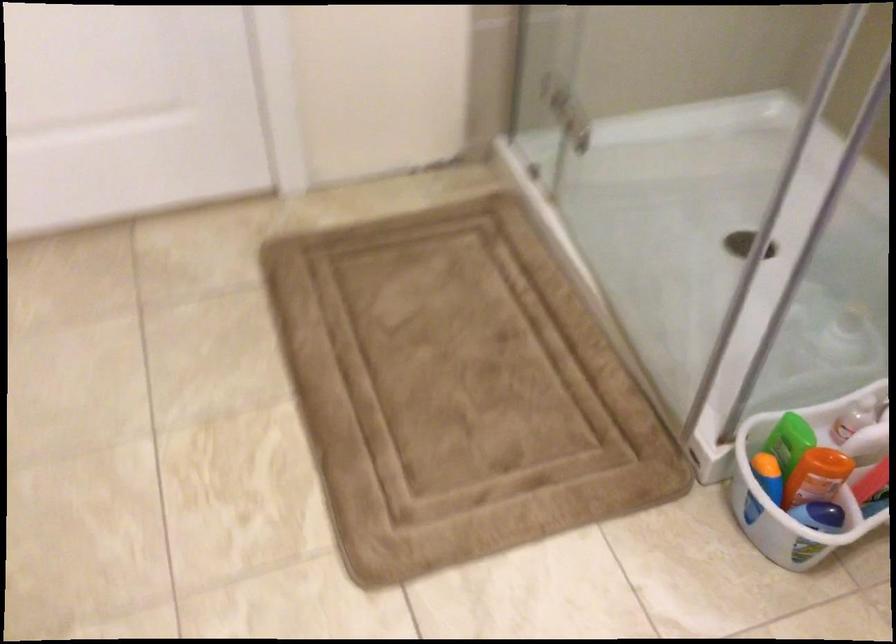
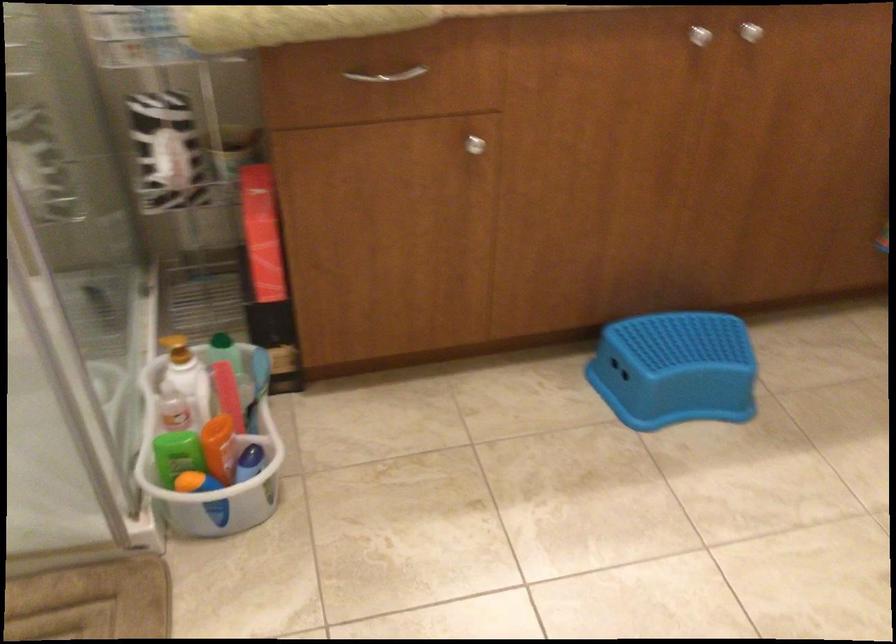
Where in the second image is the point corresponding to the point at 816,474 from the first image?

(220, 448)